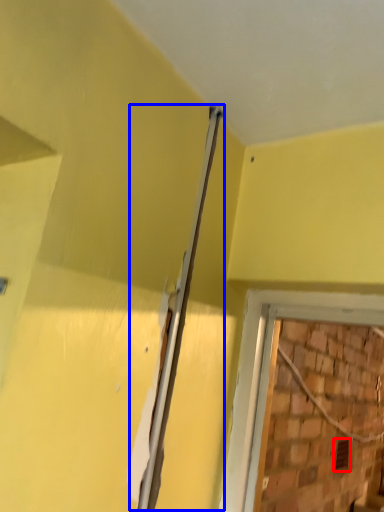
Question: Which object is further to the camera taking this photo, hole (highlighted by a red box) or beam (highlighted by a blue box)?

Choices:
 (A) hole
 (B) beam

Answer: (A)